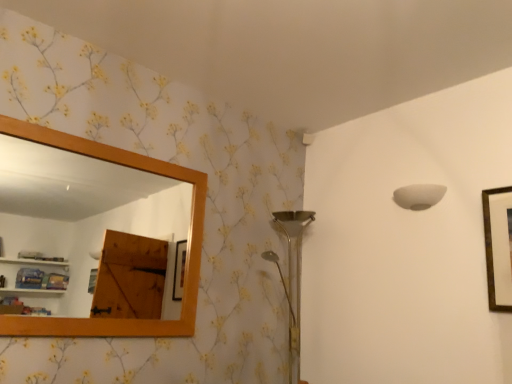
Where is `gold-framed picture at upper right`? This screenshot has width=512, height=384. gold-framed picture at upper right is located at coordinates (498, 247).

Which is in front, point (411, 187) or point (174, 306)?

The point (174, 306) is in front.

From a real-world perspective, is white matte lampshade at upper right physically above wooden frame mirror at upper left?

Indeed, from a real-world perspective, white matte lampshade at upper right stands above wooden frame mirror at upper left.

Considering the relative positions of white matte lampshade at upper right and wooden frame mirror at upper left in the image provided, is white matte lampshade at upper right to the left or to the right of wooden frame mirror at upper left?

white matte lampshade at upper right is to the right of wooden frame mirror at upper left.

Is wooden frame mirror at upper left turned away from gold-framed picture at upper right?

No, wooden frame mirror at upper left is not facing away from gold-framed picture at upper right.

Is the surface of wooden frame mirror at upper left in direct contact with gold-framed picture at upper right?

No, wooden frame mirror at upper left is not next to gold-framed picture at upper right.

From the image's perspective, relative to wooden frame mirror at upper left, is gold-framed picture at upper right above or below?

Based on their image positions, gold-framed picture at upper right is located beneath wooden frame mirror at upper left.

Does gold-framed picture at upper right lie behind wooden frame mirror at upper left?

Yes, gold-framed picture at upper right is further from the viewer.

Is gold-framed picture at upper right facing towards wooden frame mirror at upper left?

No, gold-framed picture at upper right is not aimed at wooden frame mirror at upper left.

Considering the positions of point (493, 286) and point (90, 166), is point (493, 286) closer or farther from the camera than point (90, 166)?

Point (493, 286) is positioned closer to the camera compared to point (90, 166).

From a real-world perspective, relative to white matte lampshade at upper right, is wooden frame mirror at upper left vertically above or below?

From a real-world perspective, wooden frame mirror at upper left is physically below white matte lampshade at upper right.

Which object is further away from the camera, wooden frame mirror at upper left or white matte lampshade at upper right?

white matte lampshade at upper right is more distant.

From the picture: Does wooden frame mirror at upper left appear on the right side of white matte lampshade at upper right?

In fact, wooden frame mirror at upper left is to the left of white matte lampshade at upper right.

Is gold-framed picture at upper right spatially inside white matte lampshade at upper right, or outside of it?

gold-framed picture at upper right is not enclosed by white matte lampshade at upper right.

From the image's perspective, which is above, gold-framed picture at upper right or white matte lampshade at upper right?

white matte lampshade at upper right appears higher in the image.

Does gold-framed picture at upper right come behind white matte lampshade at upper right?

No, gold-framed picture at upper right is in front of white matte lampshade at upper right.

How distant is gold-framed picture at upper right from white matte lampshade at upper right?

gold-framed picture at upper right is 14.68 inches from white matte lampshade at upper right.

From a real-world perspective, between white matte lampshade at upper right and gold-framed picture at upper right, who is vertically higher?

white matte lampshade at upper right, from a real-world perspective.

How much distance is there between white matte lampshade at upper right and gold-framed picture at upper right?

white matte lampshade at upper right and gold-framed picture at upper right are 37.29 centimeters apart from each other.

From the picture: Who is taller, white matte lampshade at upper right or gold-framed picture at upper right?

Standing taller between the two is gold-framed picture at upper right.

Is point (433, 194) positioned behind point (509, 187)?

Yes, it is behind point (509, 187).

Where is `lamp on the right of wooden frame mirror at upper left`? Image resolution: width=512 pixels, height=384 pixels. lamp on the right of wooden frame mirror at upper left is located at coordinates (419, 196).

Find the location of a particular element. The image size is (512, 384). mirror in front of the gold-framed picture at upper right is located at coordinates (82, 216).

Looking at the image, which one is located further to gold-framed picture at upper right, wooden frame mirror at upper left or white matte lampshade at upper right?

The object further to gold-framed picture at upper right is wooden frame mirror at upper left.

Which object lies nearer to the anchor point gold-framed picture at upper right, white matte lampshade at upper right or wooden frame mirror at upper left?

white matte lampshade at upper right.

Considering their positions, is wooden frame mirror at upper left positioned further to white matte lampshade at upper right than gold-framed picture at upper right?

wooden frame mirror at upper left is positioned further to the anchor white matte lampshade at upper right.

Considering their positions, is gold-framed picture at upper right positioned further to wooden frame mirror at upper left than white matte lampshade at upper right?

Based on the image, gold-framed picture at upper right appears to be further to wooden frame mirror at upper left.

Considering their positions, is white matte lampshade at upper right positioned closer to wooden frame mirror at upper left than gold-framed picture at upper right?

→ white matte lampshade at upper right is positioned closer to the anchor wooden frame mirror at upper left.

From the image, which object appears to be farther from white matte lampshade at upper right, gold-framed picture at upper right or wooden frame mirror at upper left?

wooden frame mirror at upper left.

At what (x,y) coordinates should I click in order to perform the action: click on lamp between wooden frame mirror at upper left and gold-framed picture at upper right. Please return your answer as a coordinate pair (x, y). Looking at the image, I should click on (419, 196).